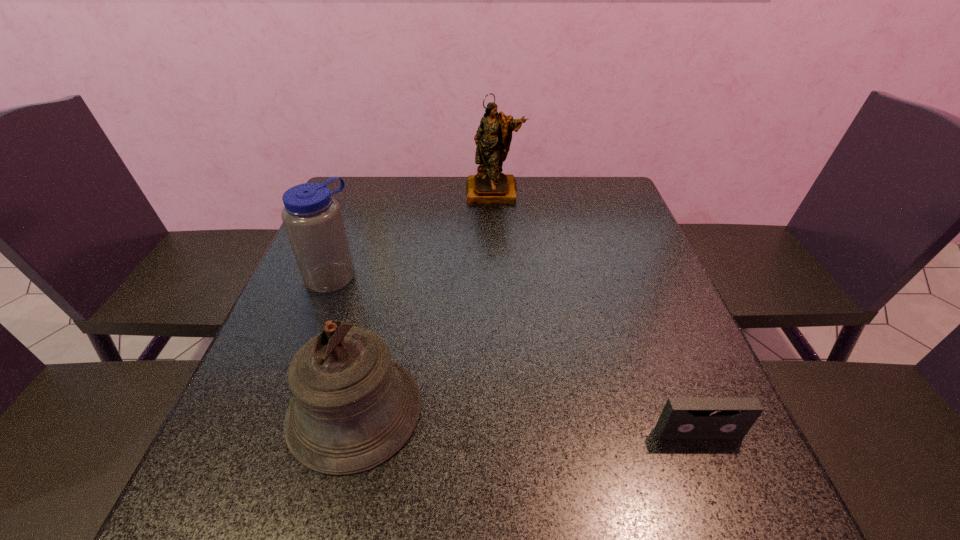
Image resolution: width=960 pixels, height=540 pixels. What are the coordinates of `object present at the near right corner` in the screenshot? It's located at (682, 417).

This screenshot has width=960, height=540. Identify the location of vacant region at the far edge of the desktop. (500, 217).

I want to click on free spot at the near edge of the desktop, so click(644, 448).

This screenshot has height=540, width=960. I want to click on vacant space at the left edge of the desktop, so click(287, 347).

I want to click on free region at the right edge of the desktop, so click(x=671, y=287).

Locate an element on the screen. The height and width of the screenshot is (540, 960). free space at the far right corner is located at coordinates (577, 181).

Identify the location of unoccupied position between the bell and the shortest object. (527, 422).

Where is `free space between the shortest object and the third nearest object`? free space between the shortest object and the third nearest object is located at coordinates point(515,354).

I want to click on unoccupied area between the shortest object and the bell, so click(x=527, y=422).

Locate an element on the screen. Image resolution: width=960 pixels, height=540 pixels. free space that is in between the rightmost object and the farthest object is located at coordinates 596,312.